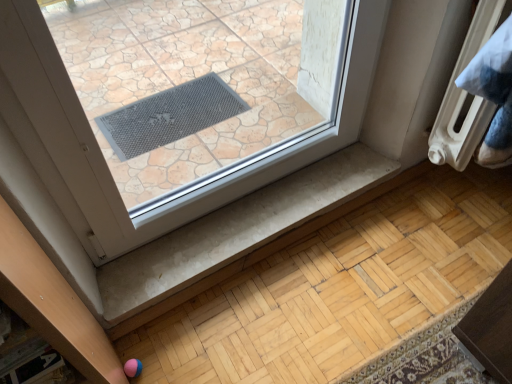
Question: Looking at the image, does white matte stair at lower center seem bigger or smaller compared to white plastic radiator at upper right?

Choices:
 (A) big
 (B) small

Answer: (B)

Question: From their relative heights in the image, would you say white matte stair at lower center is taller or shorter than white plastic radiator at upper right?

Choices:
 (A) tall
 (B) short

Answer: (B)

Question: Would you say white matte stair at lower center is to the left or to the right of white plastic radiator at upper right in the picture?

Choices:
 (A) left
 (B) right

Answer: (A)

Question: Relative to white matte stair at lower center, is white plastic radiator at upper right in front or behind?

Choices:
 (A) front
 (B) behind

Answer: (A)

Question: Is point (486, 125) positioned closer to the camera than point (142, 271)?

Choices:
 (A) closer
 (B) farther

Answer: (A)

Question: Is white plastic radiator at upper right spatially inside white matte stair at lower center, or outside of it?

Choices:
 (A) inside
 (B) outside

Answer: (B)

Question: Considering the positions of white plastic radiator at upper right and white matte stair at lower center in the image, is white plastic radiator at upper right taller or shorter than white matte stair at lower center?

Choices:
 (A) tall
 (B) short

Answer: (A)